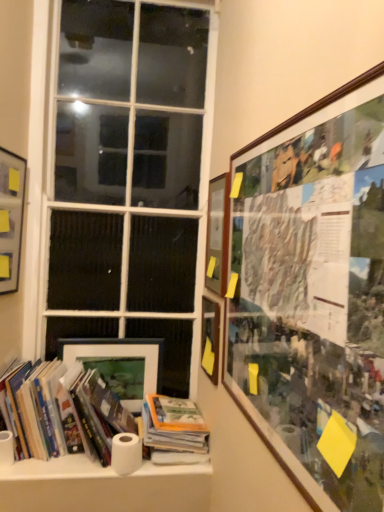
Question: From their relative heights in the image, would you say white matte toilet paper at lower center is taller or shorter than hardcover book at center, marked as the 2th book in a left-to-right arrangement?

Choices:
 (A) short
 (B) tall

Answer: (A)

Question: From a real-world perspective, is white matte toilet paper at lower center positioned above or below hardcover book at center, marked as the 2th book in a left-to-right arrangement?

Choices:
 (A) below
 (B) above

Answer: (A)

Question: Considering the real-world distances, which object is farthest from the matte black picture frame at lower left, the second picture frame viewed from the left?

Choices:
 (A) white matte paper towel at lower left
 (B) wooden picture frame at upper right, the 4th picture frame when ordered from left to right
 (C) matte black picture frame at upper left, the first picture frame positioned from the left
 (D) white matte paper towel at lower left
 (E) hardcover books at lower left, positioned as the first book in left-to-right order

Answer: (B)

Question: Estimate the real-world distances between objects in this image. Which object is farther from the hardcover book at center, the 1th book when ordered from right to left?

Choices:
 (A) white glass window at center
 (B) wooden picture frame at upper right, the 2th picture frame when ordered from right to left
 (C) matte wooden picture frame at center, the third picture frame positioned from the right
 (D) wooden framed collage at upper right, the 1th picture frame viewed from the right
 (E) white matte toilet paper at lower center

Answer: (D)